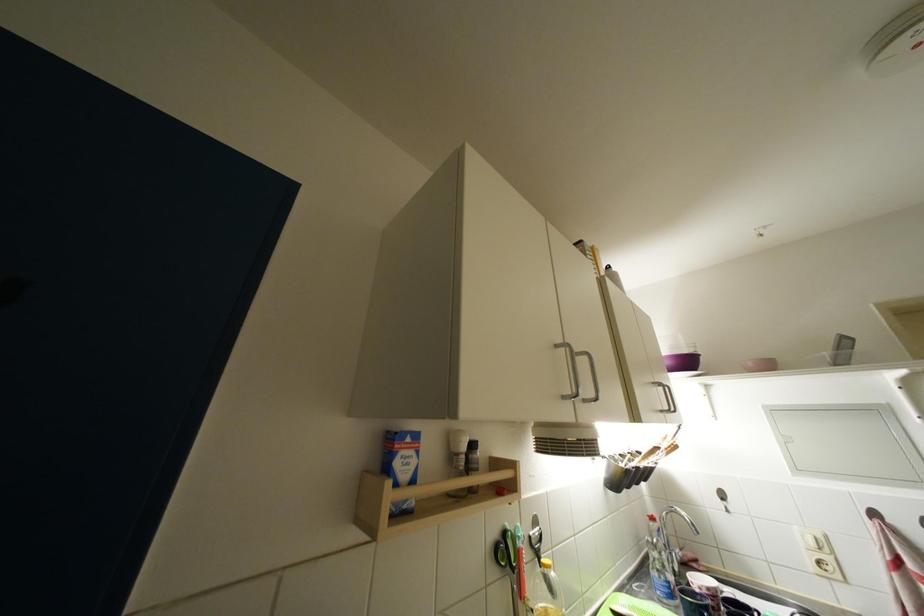
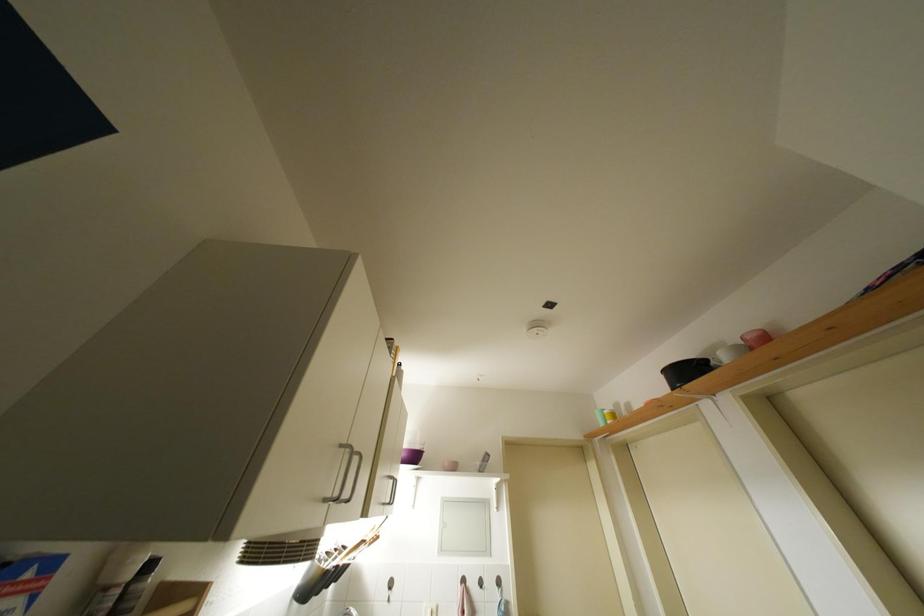
The point at (805, 474) is marked in the first image. Where is the corresponding point in the second image?

(447, 554)